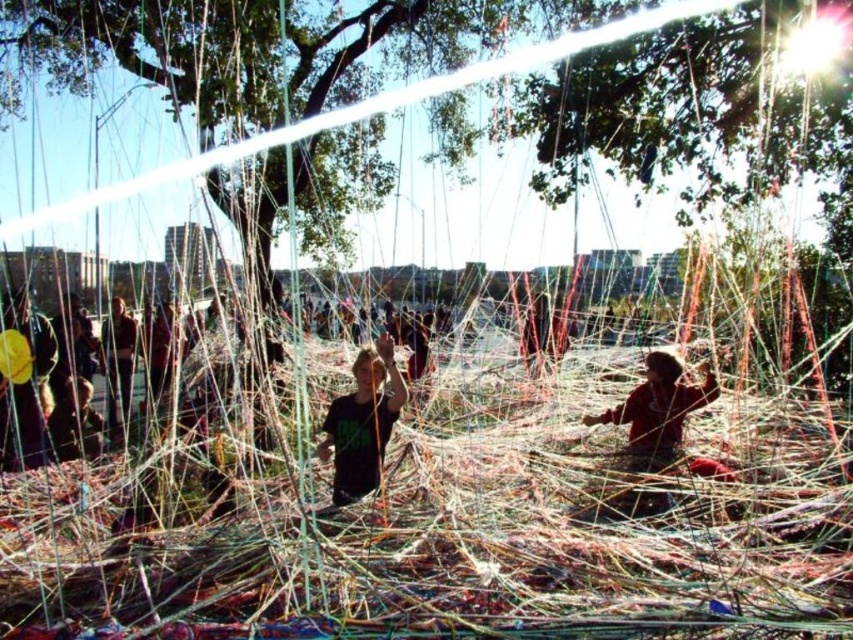
Based on the photo, does matte black shirt at center appear on the right side of red fabric child at lower right?

Incorrect, matte black shirt at center is not on the right side of red fabric child at lower right.

Who is higher up, matte black shirt at center or red fabric child at lower right?

Positioned higher is red fabric child at lower right.

Locate an element on the screen. matte black shirt at center is located at coordinates (363, 422).